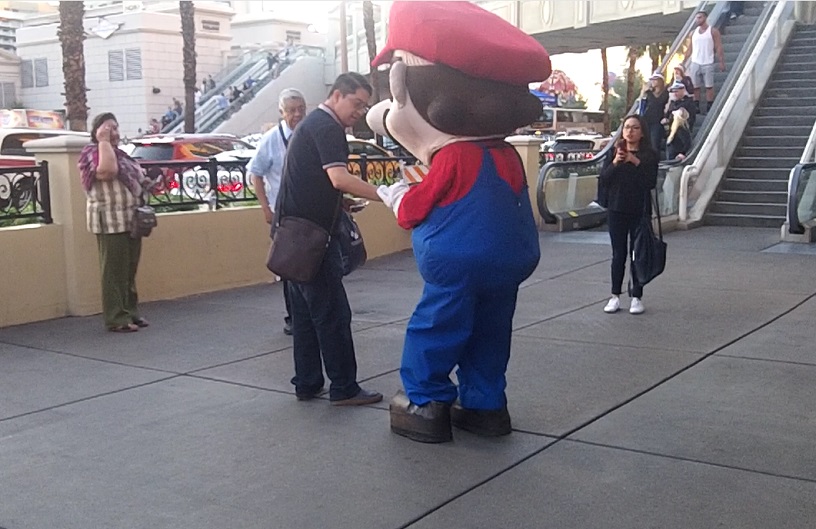
Locate an element on the screen. stairs is located at coordinates (765, 155).